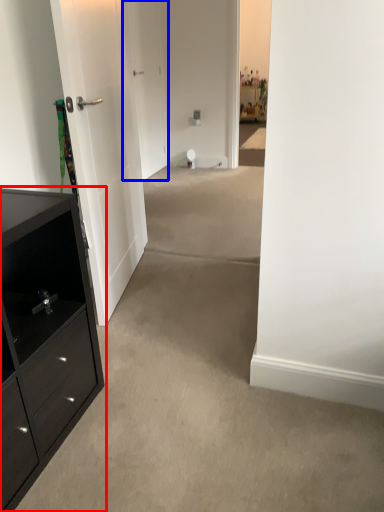
Question: Which point is further to the camera, chest of drawers (highlighted by a red box) or door (highlighted by a blue box)?

Choices:
 (A) chest of drawers
 (B) door

Answer: (B)